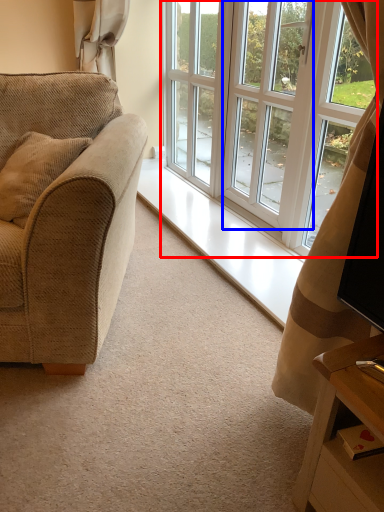
Question: Which point is further to the camera, window (highlighted by a red box) or screen door (highlighted by a blue box)?

Choices:
 (A) window
 (B) screen door

Answer: (B)